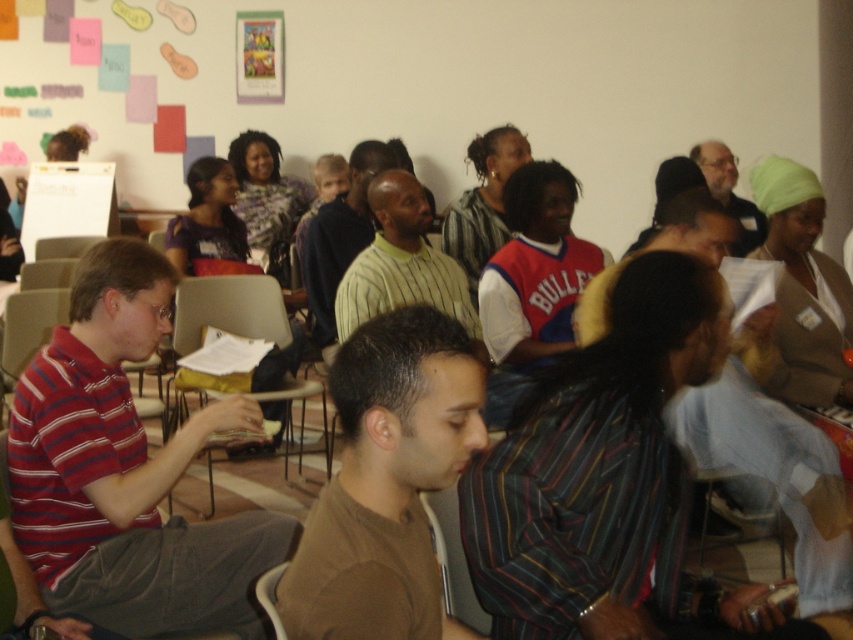
Question: Can you confirm if beige plastic chair at center is positioned below matte black shirt at upper right?

Choices:
 (A) no
 (B) yes

Answer: (B)

Question: Which is nearer to the wooden chair at lower center?

Choices:
 (A) brown cotton shirt at center
 (B) striped cotton shirt at left

Answer: (A)

Question: Among these points, which one is farthest from the camera?

Choices:
 (A) (279, 637)
 (B) (532, 244)
 (C) (387, 262)
 (D) (26, 548)

Answer: (C)

Question: Does brown cotton shirt at center have a lesser width compared to wooden chair at lower center?

Choices:
 (A) no
 (B) yes

Answer: (A)

Question: Is striped cotton shirt at left positioned at the back of beige plastic chair at center?

Choices:
 (A) no
 (B) yes

Answer: (A)

Question: Which point is closer to the camera?

Choices:
 (A) (86, 612)
 (B) (757, 417)

Answer: (A)